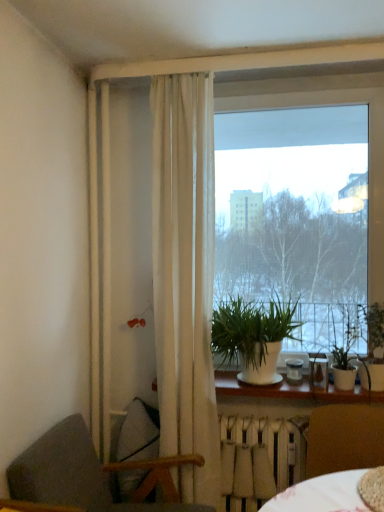
Question: Looking at their shapes, would you say white wood window sill at lower center is wider or thinner than white matte radiator at lower center?

Choices:
 (A) wide
 (B) thin

Answer: (A)

Question: From the image's perspective, is white wood window sill at lower center positioned above or below white matte radiator at lower center?

Choices:
 (A) above
 (B) below

Answer: (A)

Question: Which object is the closest to the green matte plant at right, the 1th houseplant in the right-to-left sequence?

Choices:
 (A) brown leather chair at lower right, placed as the first chair when sorted from right to left
 (B) green matte plant at right, acting as the second houseplant starting from the left
 (C) transparent glass window at center
 (D) white matte radiator at lower center
 (E) white matte plant at center, the 1th houseplant from the left

Answer: (B)

Question: Considering the real-world distances, which object is closest to the white matte plant at center, the 3th houseplant positioned from the right?

Choices:
 (A) dark gray fabric chair at lower left, the second chair from the right
 (B) transparent glass window at center
 (C) green matte plant at right, acting as the second houseplant starting from the left
 (D) white matte radiator at lower center
 (E) white wood window sill at lower center

Answer: (E)